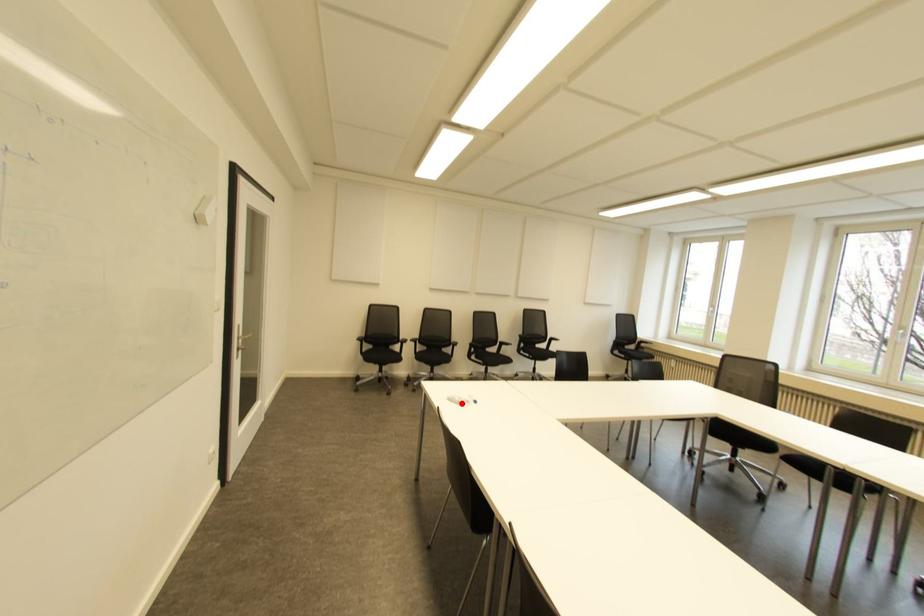
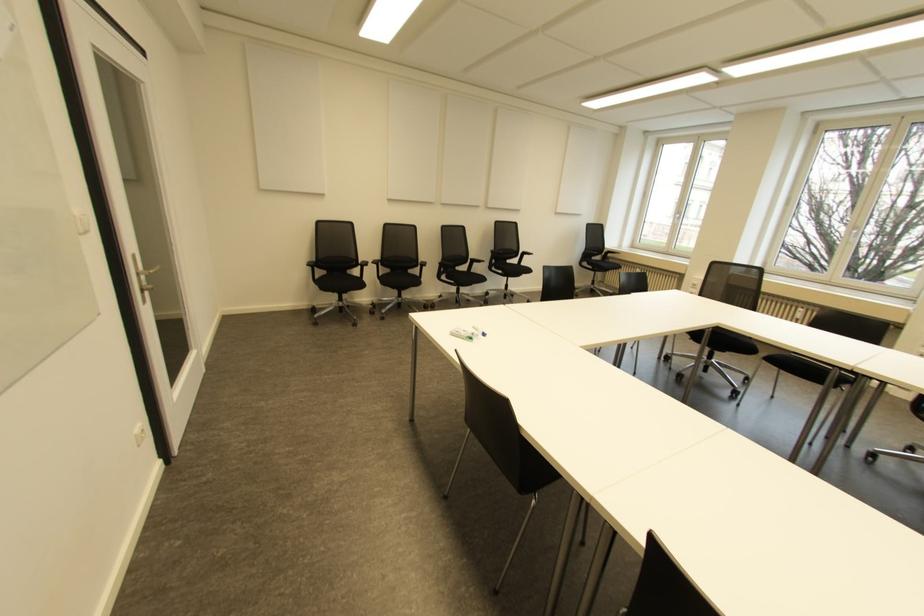
Question: I am providing you with two images of the same scene from different viewpoints. In image1, a red point is highlighted. Considering the same 3D point in image2, which of the following is correct?

Choices:
 (A) It is closer
 (B) It is farther

Answer: (B)